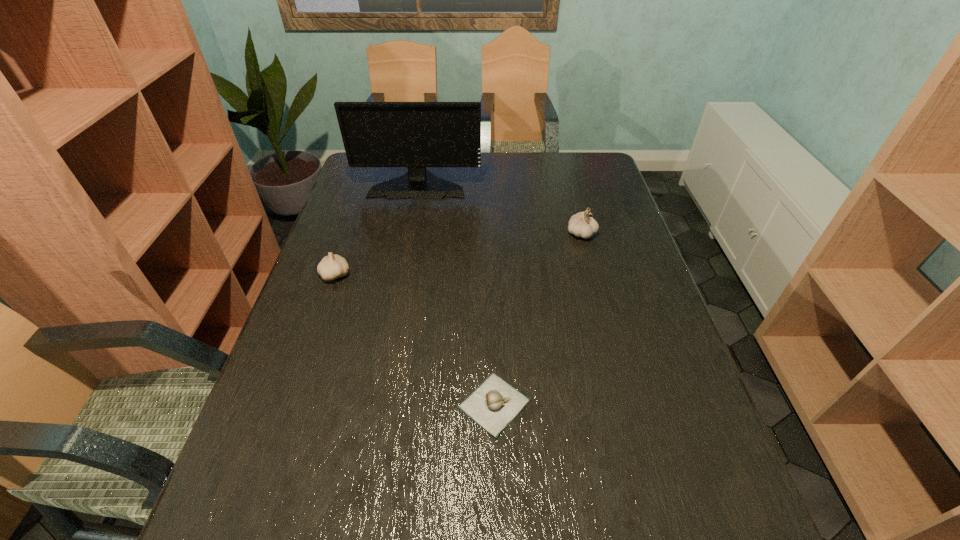
The height and width of the screenshot is (540, 960). Find the location of `free space located 0.330m on the front of the second farthest garlic`. free space located 0.330m on the front of the second farthest garlic is located at coordinates (296, 394).

The width and height of the screenshot is (960, 540). In order to click on vacant space positioned on the back of the nearest garlic in this screenshot , I will do `click(492, 303)`.

Locate an element on the screen. object at the far edge is located at coordinates (416, 135).

Where is `monitor positioned at the left edge`? Image resolution: width=960 pixels, height=540 pixels. monitor positioned at the left edge is located at coordinates (416, 135).

This screenshot has width=960, height=540. I want to click on garlic located in the left edge section of the desktop, so click(x=333, y=266).

Locate an element on the screen. This screenshot has width=960, height=540. object that is positioned at the right edge is located at coordinates pyautogui.click(x=582, y=224).

The width and height of the screenshot is (960, 540). What are the coordinates of `object situated at the far left corner` in the screenshot? It's located at (416, 135).

Locate an element on the screen. vacant space at the far edge of the desktop is located at coordinates (524, 181).

Find the location of a particular element. vacant space at the left edge is located at coordinates pyautogui.click(x=344, y=255).

Find the location of a particular element. The height and width of the screenshot is (540, 960). blank space at the right edge is located at coordinates (684, 424).